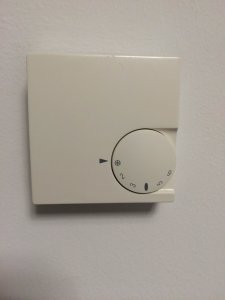
You are a GUI agent. You are given a task and a screenshot of the screen. Output one action in this format:
    pyautogui.click(x=<x>, y=<y>)
    Task: Click on the wall on the top
    The height and width of the screenshot is (300, 225).
    Given the screenshot: What is the action you would take?
    pyautogui.click(x=103, y=41)